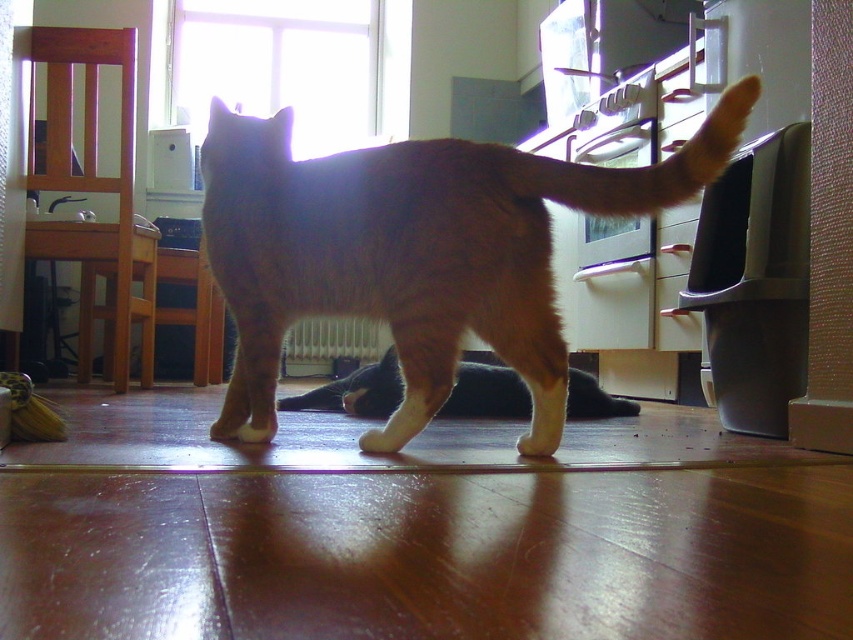
You are a photographer trying to capture the orange fur tail at upper right in the image. Based on the scene description, where should you focus your camera to ensure the tail is in the frame?

The orange fur tail at upper right is located at point (640,166), so you should focus your camera on that coordinate to ensure the tail is in the frame.

You are a photographer standing in the room where the orange fur tabby cat at center is walking away from you towards the window. You want to take a closeup photo of the cat without disturbing it. Considering the distance between you and the cat, can you estimate if you can approach within 1 meter to take the photo?

The orange fur tabby cat at center is 1.16 meters away from the viewer. Since you need to approach within 1 meter, you can move closer by 0.16 meters to achieve the desired distance without disturbing the cat.